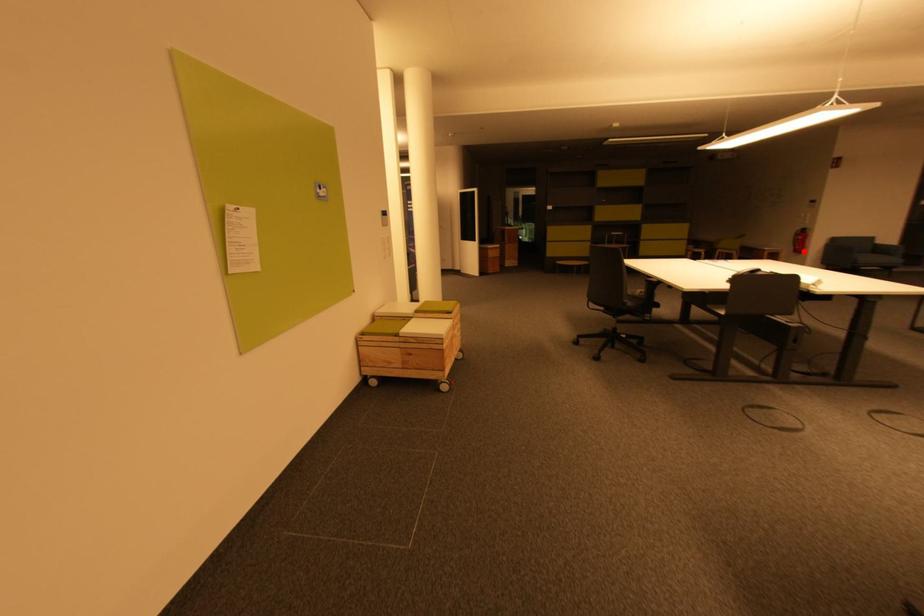
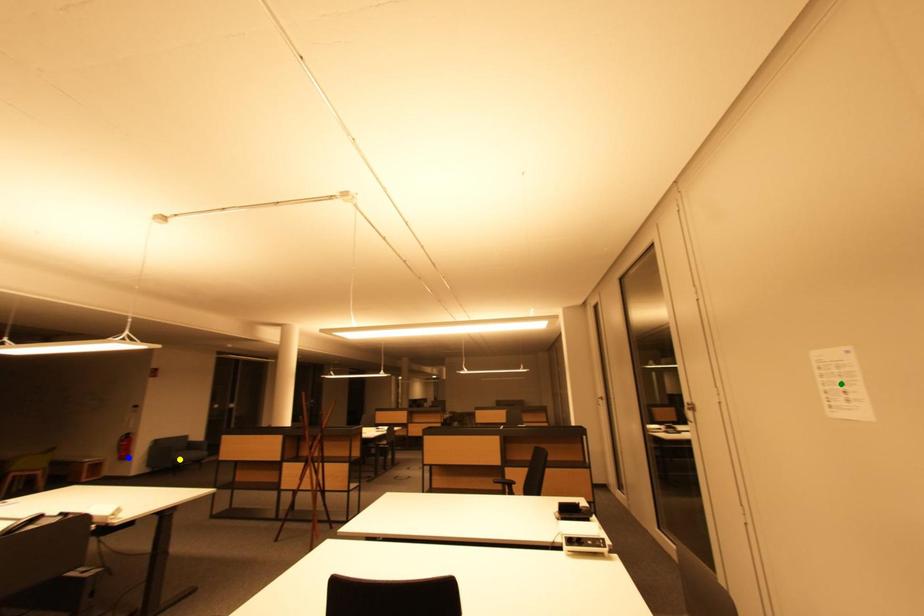
Question: I am providing you with two images of the same scene from different viewpoints. A red point is marked on the first image. You are given multiple points on the second image. Which mark in image 2 goes with the point in image 1?

Choices:
 (A) blue point
 (B) green point
 (C) yellow point

Answer: (A)